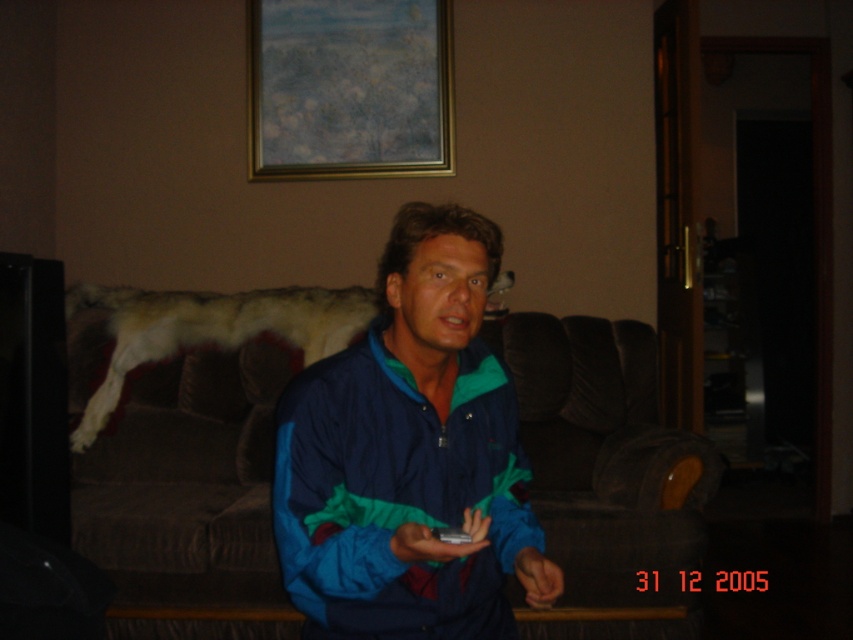
You are a guest in this living room and want to place your phone on the brown fabric couch at center. However, you notice the black plastic remote at center is already there. Where should you place your phone so it doesn

The brown fabric couch at center is to the right of the black plastic remote at center, so you should place your phone to the left of the black plastic remote at center to ensure it is on the couch.

You are a guest in this living room and want to place the black plastic remote at center on the brown fabric couch at center. Is the remote currently above or below the couch?

The brown fabric couch at center is below the black plastic remote at center, so the remote is currently above the couch.